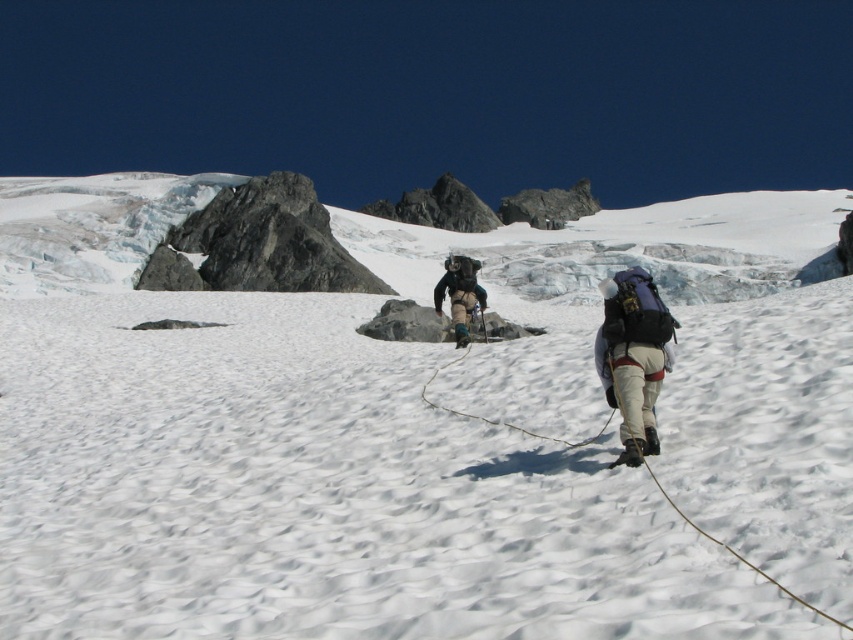
Is white powdery snow at center positioned before dark gray fabric backpack at center?

Yes, white powdery snow at center is closer to the viewer.

Which of these two, white powdery snow at center or dark gray fabric backpack at center, stands shorter?

With less height is dark gray fabric backpack at center.

What are the coordinates of `white powdery snow at center` in the screenshot? It's located at (418, 433).

Is point (645, 314) less distant than point (691, 524)?

No.

Is point (660, 353) in front of point (500, 424)?

Yes, it is in front of point (500, 424).

At what (x,y) coordinates should I click in order to perform the action: click on matte blue backpack at right. Please return your answer as a coordinate pair (x, y). This screenshot has width=853, height=640. Looking at the image, I should click on (634, 356).

Between point (596, 435) and point (476, 300), which one is positioned in front?

Point (596, 435)

Does brown rope at center lie in front of dark gray fabric backpack at center?

Yes, it is in front of dark gray fabric backpack at center.

The image size is (853, 640). I want to click on brown rope at center, so click(740, 554).